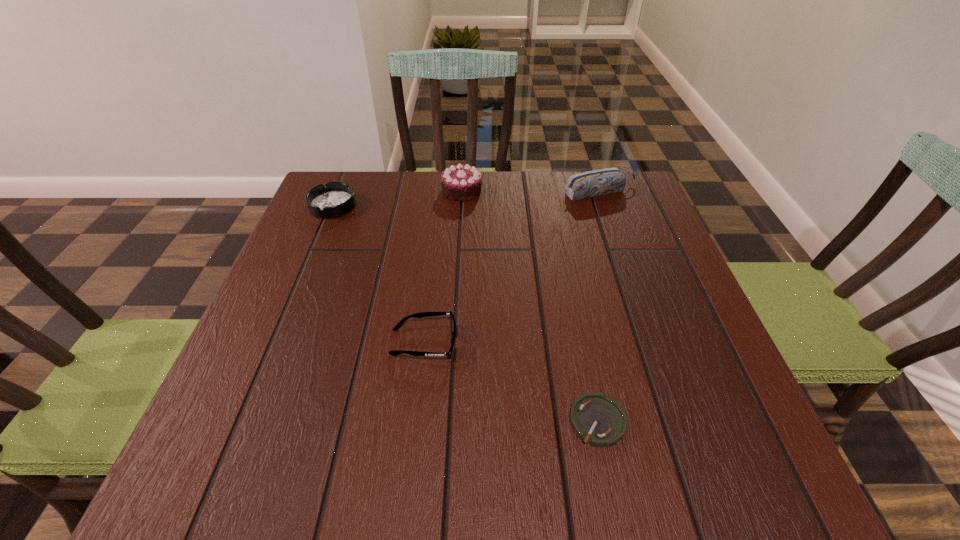
Find the location of a particular element. This screenshot has height=540, width=960. chocolate cake is located at coordinates (461, 182).

This screenshot has width=960, height=540. Identify the location of the fourth shortest object. (599, 182).

The width and height of the screenshot is (960, 540). Identify the location of the taller ashtray. coord(335,199).

This screenshot has height=540, width=960. Find the location of `the leftmost object`. the leftmost object is located at coordinates (335, 199).

I want to click on the fourth farthest object, so click(423, 314).

At what (x,y) coordinates should I click in order to perform the action: click on the right ashtray. Please return your answer as a coordinate pair (x, y). The width and height of the screenshot is (960, 540). Looking at the image, I should click on (598, 420).

Image resolution: width=960 pixels, height=540 pixels. I want to click on the nearer ashtray, so [x=598, y=420].

This screenshot has height=540, width=960. Identify the location of vacant position located on the front of the chocolate cake. (456, 308).

At what (x,y) coordinates should I click in order to perform the action: click on vacant area located on the front of the second tallest object. Please return your answer as a coordinate pair (x, y). Looking at the image, I should click on (618, 242).

Where is `vacant position located 0.060m on the back of the left ashtray`? This screenshot has height=540, width=960. vacant position located 0.060m on the back of the left ashtray is located at coordinates (343, 180).